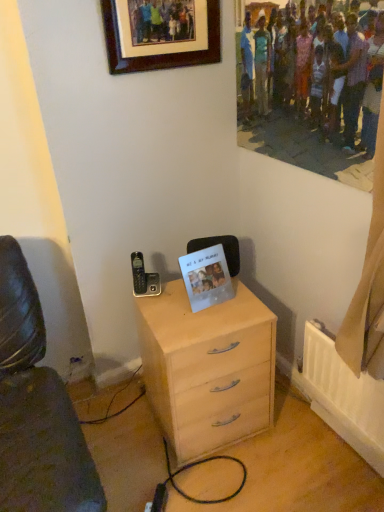
What is the approximate height of transparent plastic photo frame at center?

The height of transparent plastic photo frame at center is 9.86 inches.

This screenshot has height=512, width=384. Describe the element at coordinates (207, 368) in the screenshot. I see `light wood chest of drawers at center` at that location.

This screenshot has height=512, width=384. What do you see at coordinates (161, 34) in the screenshot?
I see `brown wooden picture frame at upper center` at bounding box center [161, 34].

Where is `transparent plastic photo frame at center`? The height and width of the screenshot is (512, 384). transparent plastic photo frame at center is located at coordinates tap(206, 277).

Which is in front, point (147, 307) or point (122, 52)?

Point (122, 52)

Is light wood chest of drawers at center placed right next to brown wooden picture frame at upper center?

light wood chest of drawers at center and brown wooden picture frame at upper center are clearly separated.

Which object is positioned more to the left, light wood chest of drawers at center or brown wooden picture frame at upper center?

Positioned to the left is brown wooden picture frame at upper center.

How different are the orientations of light wood chest of drawers at center and brown wooden picture frame at upper center in degrees?

There is a 5.5-degree angle between the facing directions of light wood chest of drawers at center and brown wooden picture frame at upper center.

Between brown wooden picture frame at upper center and light wood chest of drawers at center, which one has less height?

With less height is brown wooden picture frame at upper center.

Considering the relative sizes of brown wooden picture frame at upper center and light wood chest of drawers at center in the image provided, is brown wooden picture frame at upper center wider than light wood chest of drawers at center?

Incorrect, the width of brown wooden picture frame at upper center does not surpass that of light wood chest of drawers at center.

From a real-world perspective, is brown wooden picture frame at upper center located beneath light wood chest of drawers at center?

Actually, brown wooden picture frame at upper center is physically above light wood chest of drawers at center in the real world.

Is transparent plastic photo frame at center to the left of light wood chest of drawers at center from the viewer's perspective?

Incorrect, transparent plastic photo frame at center is not on the left side of light wood chest of drawers at center.

From a real-world perspective, between transparent plastic photo frame at center and light wood chest of drawers at center, who is vertically lower?

light wood chest of drawers at center is physically lower.

In the scene shown: Is transparent plastic photo frame at center taller or shorter than light wood chest of drawers at center?

Clearly, transparent plastic photo frame at center is shorter compared to light wood chest of drawers at center.

How many degrees apart are the facing directions of transparent plastic photo frame at center and light wood chest of drawers at center?

The facing directions of transparent plastic photo frame at center and light wood chest of drawers at center are 7.2 degrees apart.

Can we say brown wooden picture frame at upper center lies outside transparent plastic photo frame at center?

Yes.

Is brown wooden picture frame at upper center not near transparent plastic photo frame at center?

brown wooden picture frame at upper center is actually quite close to transparent plastic photo frame at center.

Between brown wooden picture frame at upper center and transparent plastic photo frame at center, which one has less height?

Standing shorter between the two is transparent plastic photo frame at center.

Between light wood chest of drawers at center and transparent plastic photo frame at center, which one has larger size?

light wood chest of drawers at center.

Is light wood chest of drawers at center aimed at transparent plastic photo frame at center?

No, light wood chest of drawers at center is not facing towards transparent plastic photo frame at center.

Is point (169, 320) closer or farther from the camera than point (193, 280)?

Point (169, 320) is positioned closer to the camera compared to point (193, 280).

From a real-world perspective, between light wood chest of drawers at center and transparent plastic photo frame at center, who is vertically lower?

From a 3D spatial view, light wood chest of drawers at center is below.

Is transparent plastic photo frame at center turned away from brown wooden picture frame at upper center?

No, brown wooden picture frame at upper center is not at the back of transparent plastic photo frame at center.

How distant is transparent plastic photo frame at center from brown wooden picture frame at upper center?

transparent plastic photo frame at center and brown wooden picture frame at upper center are 30.38 inches apart.

From the image's perspective, relative to brown wooden picture frame at upper center, is transparent plastic photo frame at center above or below?

From the image's perspective, transparent plastic photo frame at center appears below brown wooden picture frame at upper center.

Considering the positions of point (218, 298) and point (167, 55), is point (218, 298) closer or farther from the camera than point (167, 55)?

Clearly, point (218, 298) is more distant from the camera than point (167, 55).

Find the location of a particular element. The image size is (384, 512). picture frame above the light wood chest of drawers at center (from a real-world perspective) is located at coordinates (161, 34).

Locate an element on the screen. The height and width of the screenshot is (512, 384). the chest of drawers located below the brown wooden picture frame at upper center (from the image's perspective) is located at coordinates (207, 368).

Based on their spatial positions, is transparent plastic photo frame at center or light wood chest of drawers at center closer to brown wooden picture frame at upper center?

transparent plastic photo frame at center lies closer to brown wooden picture frame at upper center than the other object.

Considering their positions, is light wood chest of drawers at center positioned further to transparent plastic photo frame at center than brown wooden picture frame at upper center?

Based on the image, brown wooden picture frame at upper center appears to be further to transparent plastic photo frame at center.

Considering their positions, is light wood chest of drawers at center positioned further to brown wooden picture frame at upper center than transparent plastic photo frame at center?

light wood chest of drawers at center is further to brown wooden picture frame at upper center.

When comparing their distances from light wood chest of drawers at center, does transparent plastic photo frame at center or brown wooden picture frame at upper center seem further?

Among the two, brown wooden picture frame at upper center is located further to light wood chest of drawers at center.

Estimate the real-world distances between objects in this image. Which object is further from light wood chest of drawers at center, brown wooden picture frame at upper center or transparent plastic photo frame at center?

The object further to light wood chest of drawers at center is brown wooden picture frame at upper center.

From the image, which object appears to be farther from transparent plastic photo frame at center, brown wooden picture frame at upper center or light wood chest of drawers at center?

brown wooden picture frame at upper center.

Find the location of `postcard between brown wooden picture frame at upper center and light wood chest of drawers at center from top to bottom`. postcard between brown wooden picture frame at upper center and light wood chest of drawers at center from top to bottom is located at coordinates (206, 277).